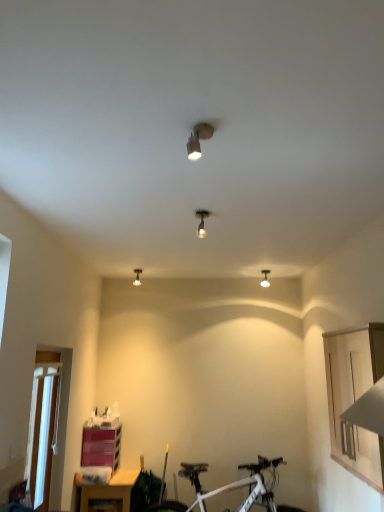
Question: Could matte white light fixture at upper center, placed as the fourth light fixture when sorted from left to right, be considered to be inside matte silver spotlight at upper center, the first light fixture from the top?

Choices:
 (A) no
 (B) yes

Answer: (A)

Question: Would you say matte silver spotlight at upper center, the 1th light fixture positioned from the front, is a long distance from matte white light fixture at upper center, marked as the 2th light fixture in a back-to-front arrangement?

Choices:
 (A) no
 (B) yes

Answer: (B)

Question: Is matte silver spotlight at upper center, the 2th light fixture from the left, at the left side of matte white light fixture at upper center, arranged as the first light fixture when viewed from the right?

Choices:
 (A) no
 (B) yes

Answer: (B)

Question: Is matte silver spotlight at upper center, the first light fixture from the top, looking in the opposite direction of matte white light fixture at upper center, arranged as the first light fixture when viewed from the right?

Choices:
 (A) yes
 (B) no

Answer: (B)

Question: Can you confirm if matte silver spotlight at upper center, the 1th light fixture positioned from the front, is bigger than matte white light fixture at upper center, marked as the 2th light fixture in a back-to-front arrangement?

Choices:
 (A) yes
 (B) no

Answer: (B)

Question: Is pink plastic shelf at lower left spatially inside matte silver spotlight at upper center, the 1th light fixture positioned from the front, or outside of it?

Choices:
 (A) outside
 (B) inside

Answer: (A)

Question: Based on their positions, is pink plastic shelf at lower left located to the left or right of matte silver spotlight at upper center, the 2th light fixture from the left?

Choices:
 (A) left
 (B) right

Answer: (A)

Question: In the image, is pink plastic shelf at lower left positioned in front of or behind matte silver spotlight at upper center, the fourth light fixture ordered from the bottom?

Choices:
 (A) front
 (B) behind

Answer: (B)

Question: Considering the positions of pink plastic shelf at lower left and matte silver spotlight at upper center, the first light fixture from the top, in the image, is pink plastic shelf at lower left wider or thinner than matte silver spotlight at upper center, the first light fixture from the top,?

Choices:
 (A) thin
 (B) wide

Answer: (B)

Question: Would you say matte silver spotlight at center, the second light fixture positioned from the right, is to the left or to the right of matte silver spotlight at upper center, the fourth light fixture ordered from the bottom, in the picture?

Choices:
 (A) right
 (B) left

Answer: (A)

Question: Considering the positions of matte silver spotlight at center, the 3th light fixture in the left-to-right sequence, and matte silver spotlight at upper center, the first light fixture from the top, in the image, is matte silver spotlight at center, the 3th light fixture in the left-to-right sequence, taller or shorter than matte silver spotlight at upper center, the first light fixture from the top,?

Choices:
 (A) short
 (B) tall

Answer: (B)

Question: Considering the positions of matte silver spotlight at center, the second light fixture when ordered from front to back, and matte silver spotlight at upper center, the 1th light fixture positioned from the front, in the image, is matte silver spotlight at center, the second light fixture when ordered from front to back, wider or thinner than matte silver spotlight at upper center, the 1th light fixture positioned from the front,?

Choices:
 (A) thin
 (B) wide

Answer: (B)

Question: Considering the positions of matte silver spotlight at center, the second light fixture positioned from the right, and matte silver spotlight at upper center, the first light fixture from the top, in the image, is matte silver spotlight at center, the second light fixture positioned from the right, bigger or smaller than matte silver spotlight at upper center, the first light fixture from the top,?

Choices:
 (A) big
 (B) small

Answer: (A)

Question: In terms of width, does matte silver spotlight at upper center, the fourth light fixture ordered from the bottom, look wider or thinner when compared to white plastic window screen at lower left?

Choices:
 (A) wide
 (B) thin

Answer: (A)

Question: Considering the relative positions of matte silver spotlight at upper center, the 3th light fixture from the right, and white plastic window screen at lower left in the image provided, is matte silver spotlight at upper center, the 3th light fixture from the right, to the left or to the right of white plastic window screen at lower left?

Choices:
 (A) right
 (B) left

Answer: (A)